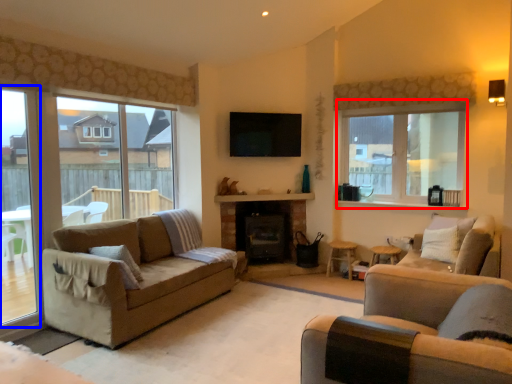
Question: Which of the following is the farthest to the observer, window (highlighted by a red box) or window frame (highlighted by a blue box)?

Choices:
 (A) window
 (B) window frame

Answer: (A)